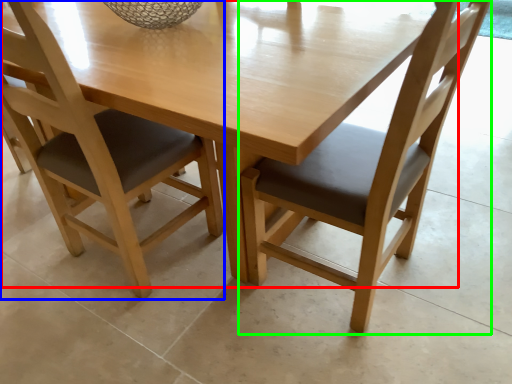
Question: Which object is positioned farthest from round table (highlighted by a red box)? Select from chair (highlighted by a blue box) and chair (highlighted by a green box).

Choices:
 (A) chair
 (B) chair

Answer: (A)